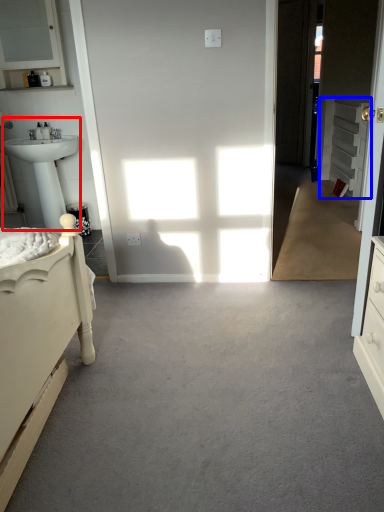
Question: Which object appears closest to the camera in this image, sink (highlighted by a red box) or cabinetry (highlighted by a blue box)?

Choices:
 (A) sink
 (B) cabinetry

Answer: (A)